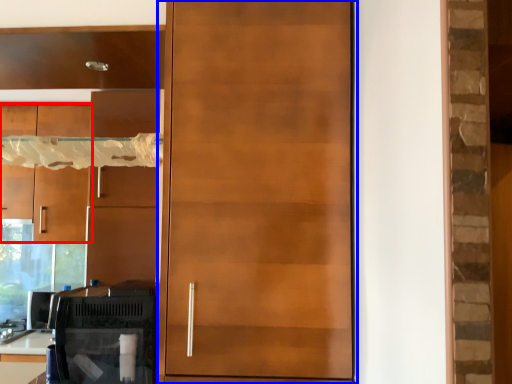
Question: Among these objects, which one is nearest to the camera, cabinetry (highlighted by a red box) or door (highlighted by a blue box)?

Choices:
 (A) cabinetry
 (B) door

Answer: (B)